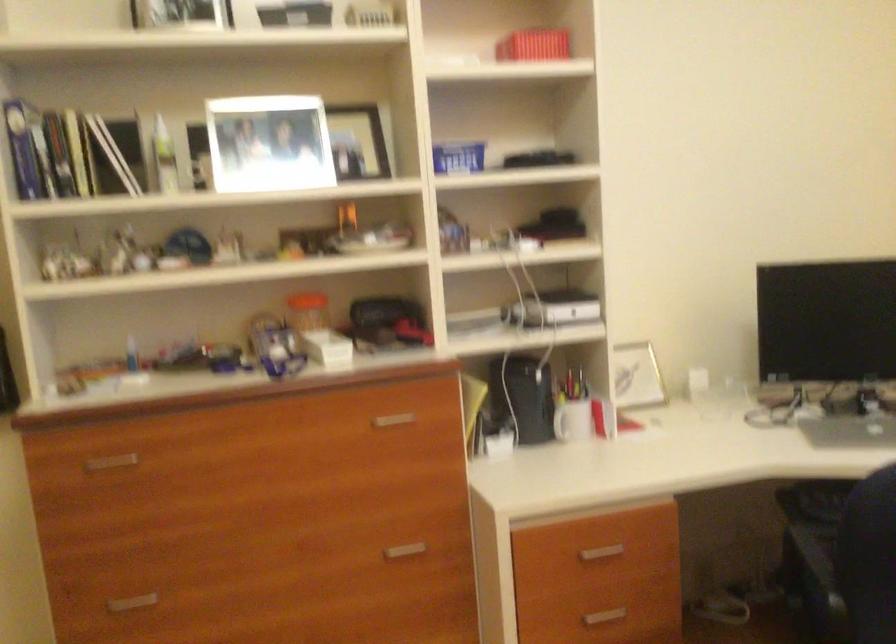
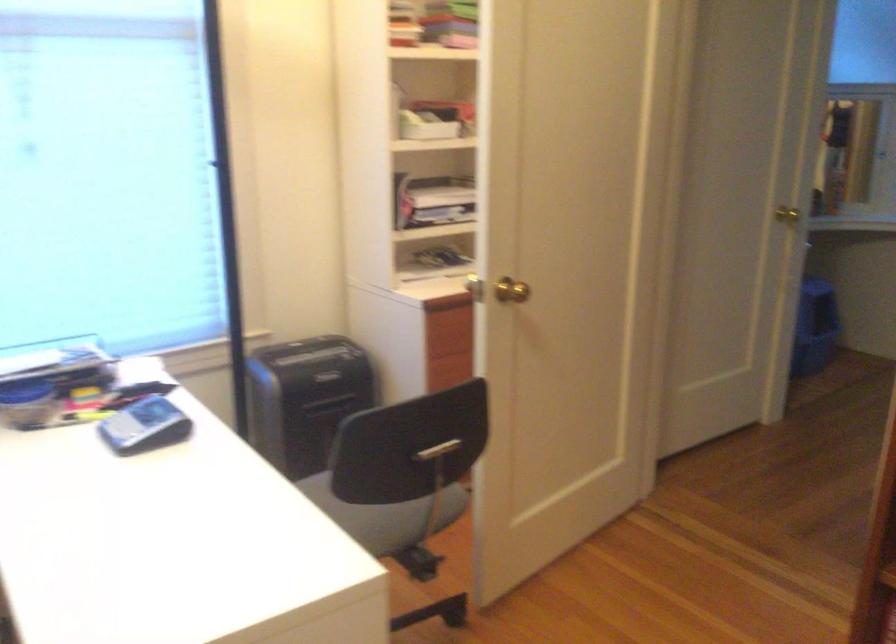
Based on the continuous images, in which direction is the camera rotating?

The camera rotated toward right-down.